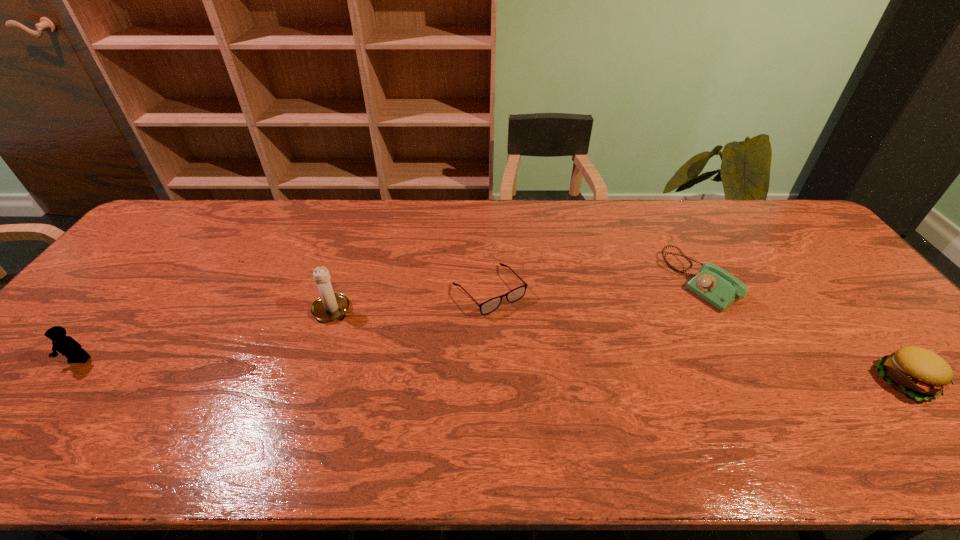
You are a GUI agent. You are given a task and a screenshot of the screen. Output one action in this format:
    pyautogui.click(x=<x>, y=<y>)
    Task: Click on the empty location between the leftmost object and the fourth tallest object
    This screenshot has width=960, height=540.
    Given the screenshot: What is the action you would take?
    pyautogui.click(x=390, y=321)

Locate an element on the screen. The height and width of the screenshot is (540, 960). vacant space that is in between the candle holder and the Lego is located at coordinates point(206,335).

This screenshot has height=540, width=960. Find the location of `free space between the second object from left to right and the leftmost object`. free space between the second object from left to right and the leftmost object is located at coordinates (206, 335).

The image size is (960, 540). In order to click on free space that is in between the hamburger and the second object from right to left in this screenshot , I will do `click(802, 331)`.

Find the location of a particular element. vacant space that is in between the hamburger and the shortest object is located at coordinates (696, 335).

Find the location of a particular element. The width and height of the screenshot is (960, 540). vacant space that is in between the tallest object and the hamburger is located at coordinates (618, 345).

At what (x,y) coordinates should I click in order to perform the action: click on vacant area that lies between the leftmost object and the telephone. Please return your answer as a coordinate pair (x, y). This screenshot has width=960, height=540. Looking at the image, I should click on (390, 321).

You are a GUI agent. You are given a task and a screenshot of the screen. Output one action in this format:
    pyautogui.click(x=<x>, y=<y>)
    Task: Click on the empty location between the hamburger and the tallest object
    The image size is (960, 540).
    Given the screenshot: What is the action you would take?
    coord(618,345)

Choose which object is the nearest neighbor to the rightmost object. Please provide its 2D coordinates. Your answer should be formatted as a tuple, i.e. [(x, y)], where the tuple contains the x and y coordinates of a point satisfying the conditions above.

[(713, 284)]

The height and width of the screenshot is (540, 960). Find the location of `object that is the third closest to the second object from left to right`. object that is the third closest to the second object from left to right is located at coordinates (713, 284).